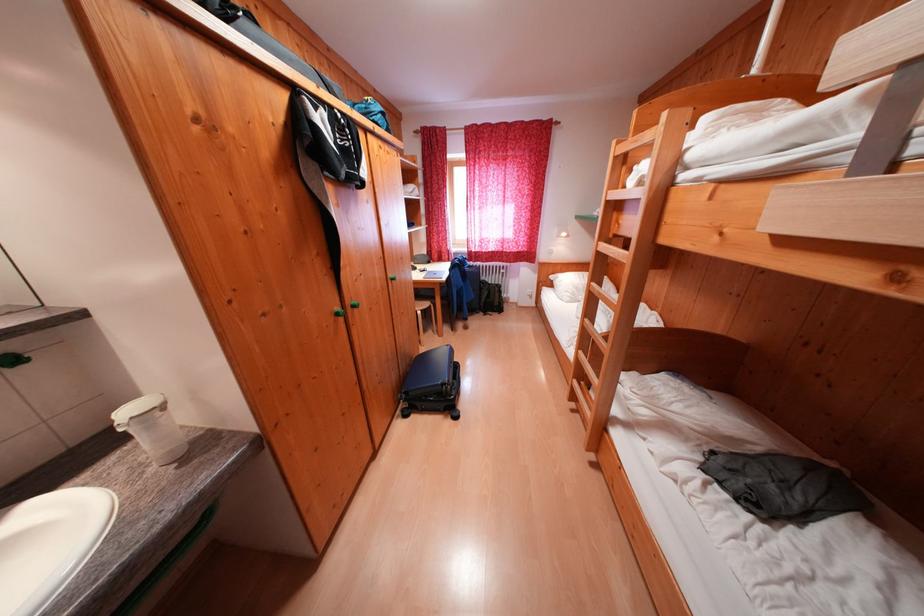
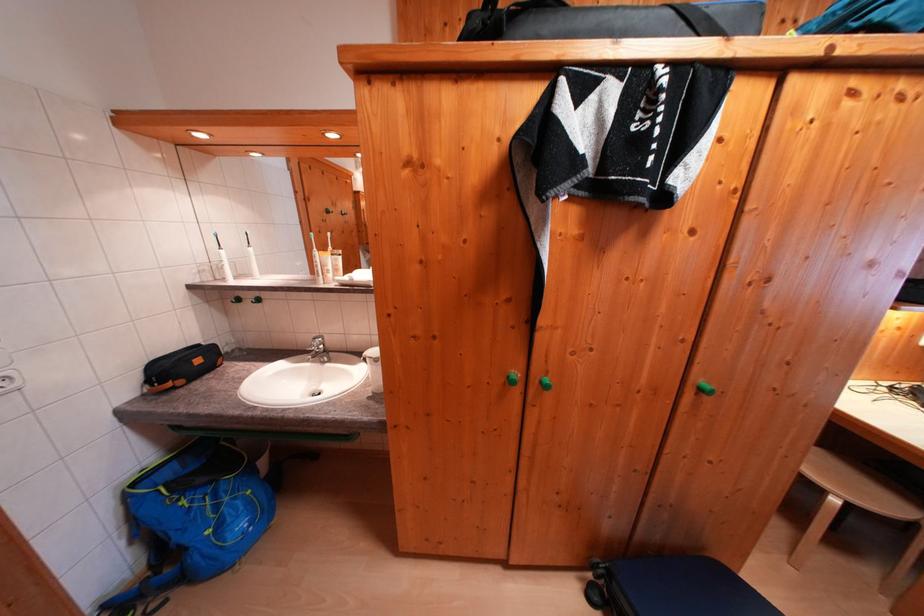
In the second image, find the point that corresponds to point 342,322 in the first image.

(511, 384)